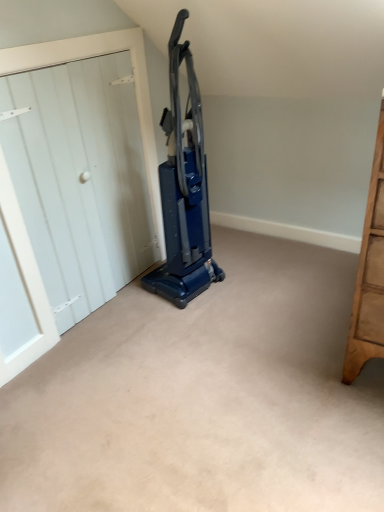
Identify the location of vacant area located to the right-hand side of white wood door at left. This screenshot has height=512, width=384. (212, 309).